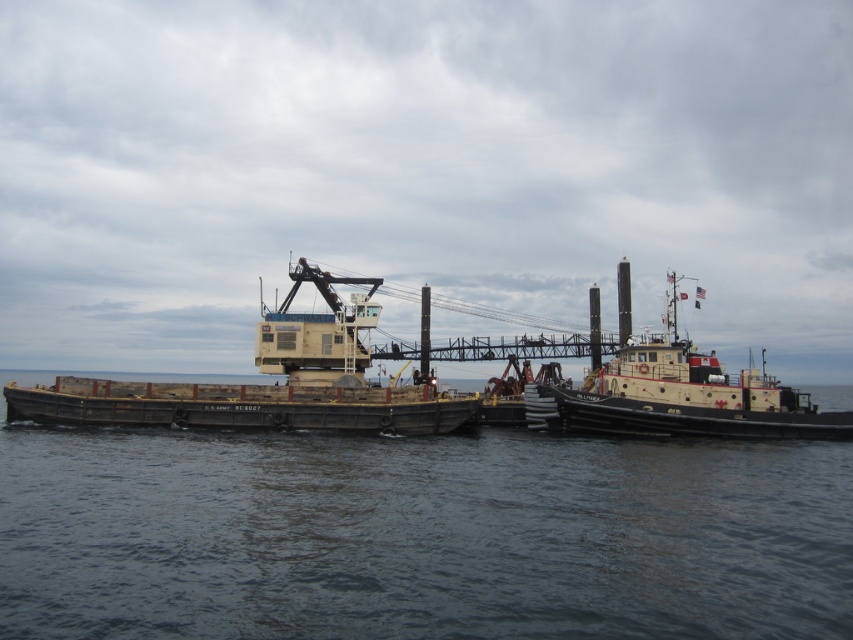
Can you confirm if yellow matte tugboat at center is thinner than dark gray matte barge at center?

Incorrect, yellow matte tugboat at center's width is not less than dark gray matte barge at center's.

Between yellow matte tugboat at center and dark gray matte barge at center, which one appears on the right side from the viewer's perspective?

yellow matte tugboat at center

Which is in front, point (642, 410) or point (355, 420)?

Point (642, 410) is in front.

The height and width of the screenshot is (640, 853). I want to click on yellow matte tugboat at center, so click(680, 396).

Does yellow matte barge at center lie behind dark gray matte barge at center?

Yes, yellow matte barge at center is further from the viewer.

Between yellow matte barge at center and dark gray matte barge at center, which one appears on the right side from the viewer's perspective?

dark gray matte barge at center is more to the right.

Does point (432, 433) lie in front of point (264, 412)?

That is False.

Find the location of `yellow matte barge at center`. yellow matte barge at center is located at coordinates (265, 385).

Who is more distant from viewer, (473, 448) or (148, 400)?

Positioned behind is point (473, 448).

Where is `dark gray water at center`? The image size is (853, 640). dark gray water at center is located at coordinates (418, 536).

I want to click on dark gray water at center, so click(x=418, y=536).